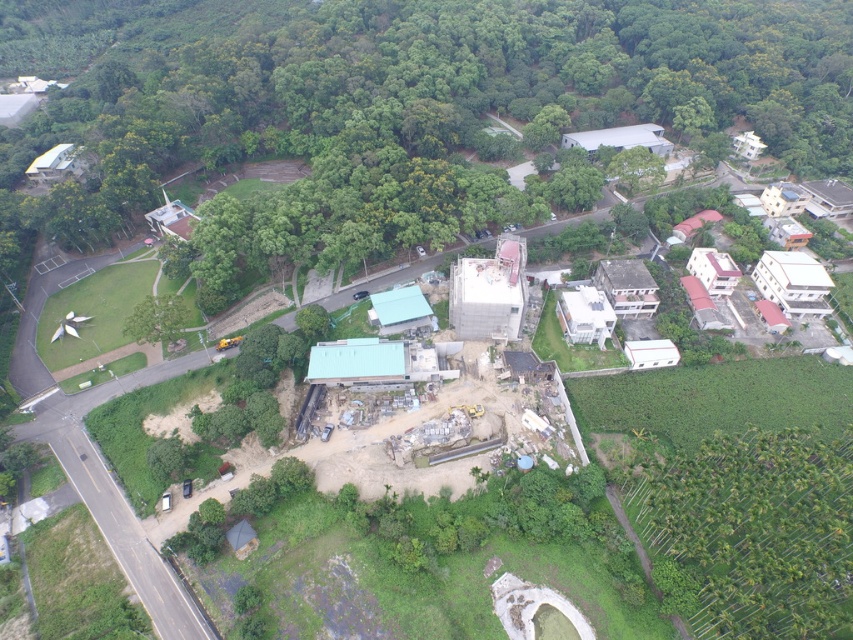
Can you confirm if green leafy tree at upper center is positioned to the left of green leafy trees at lower right?

Indeed, green leafy tree at upper center is positioned on the left side of green leafy trees at lower right.

Does point (85, 104) come behind point (764, 634)?

Yes, point (85, 104) is farther from viewer.

Find the location of `green leafy tree at upper center`. green leafy tree at upper center is located at coordinates (442, 96).